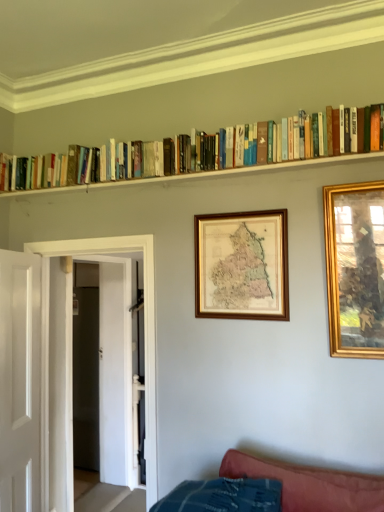
Question: Is point (66, 488) closer or farther from the camera than point (331, 202)?

Choices:
 (A) closer
 (B) farther

Answer: (B)

Question: Considering the positions of white glossy door at left, the 2th door from the front, and gold-framed picture at right, arranged as the 2th picture frame when viewed from the left, in the image, is white glossy door at left, the 2th door from the front, wider or thinner than gold-framed picture at right, arranged as the 2th picture frame when viewed from the left,?

Choices:
 (A) wide
 (B) thin

Answer: (A)

Question: Considering the real-world distances, which object is closest to the wooden framed map at center, the 1th picture frame in the left-to-right sequence?

Choices:
 (A) hardcover books at upper center
 (B) white glossy door at left, the 2th door from the front
 (C) gold-framed picture at right, the 1th picture frame positioned from the right
 (D) wooden books at upper center
 (E) white smooth door at left, acting as the 2th door starting from the back

Answer: (C)

Question: Which object is positioned farthest from the wooden books at upper center?

Choices:
 (A) white smooth door at left, acting as the 2th door starting from the back
 (B) gold-framed picture at right, the 1th picture frame positioned from the right
 (C) hardcover books at upper center
 (D) wooden framed map at center, the 2th picture frame in the right-to-left sequence
 (E) white glossy door at left, the 2th door from the front

Answer: (E)